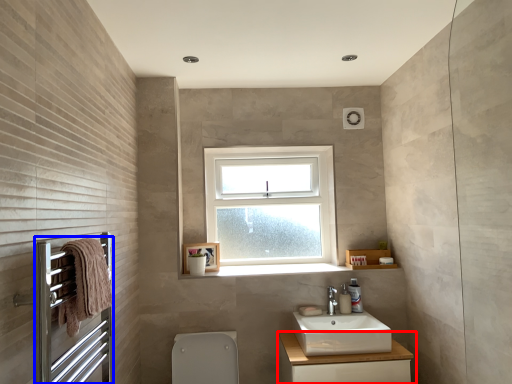
Question: Which object appears closest to the camera in this image, bathroom cabinet (highlighted by a red box) or screen door (highlighted by a blue box)?

Choices:
 (A) bathroom cabinet
 (B) screen door

Answer: (B)